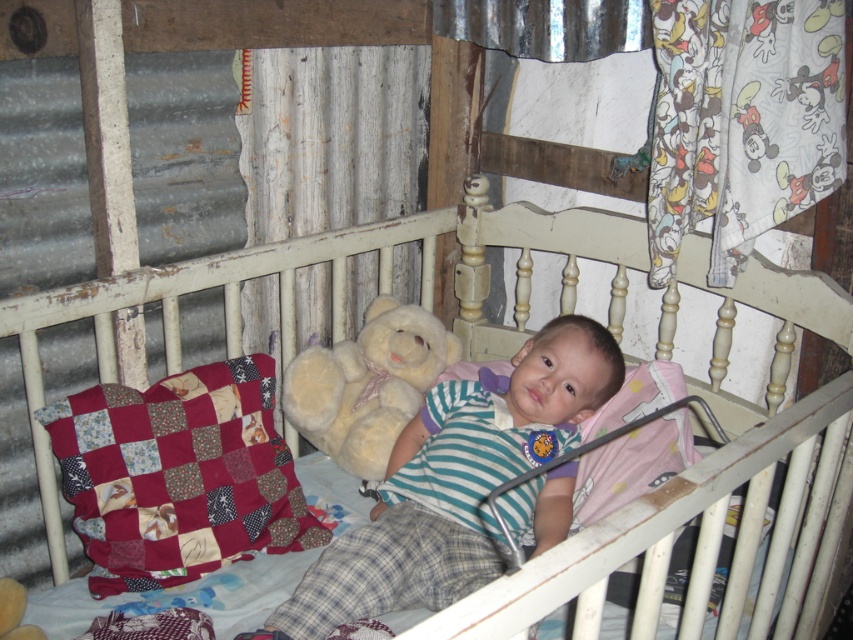
Who is more distant from viewer, [102,369] or [314,378]?

Positioned behind is point [314,378].

Is white wooden crib at center smaller than fluffy white teddy bear at center?

No, white wooden crib at center is not smaller than fluffy white teddy bear at center.

Is point (57, 534) more distant than point (408, 348)?

No, it is in front of (408, 348).

Identify the location of white wooden crib at center. The image size is (853, 640). (711, 480).

Does patchwork fabric pillow at left have a greater height compared to fluffy white teddy bear at center?

Correct, patchwork fabric pillow at left is much taller as fluffy white teddy bear at center.

The width and height of the screenshot is (853, 640). Describe the element at coordinates (178, 476) in the screenshot. I see `patchwork fabric pillow at left` at that location.

Is point (120, 532) farther from viewer compared to point (299, 392)?

No, it is in front of (299, 392).

This screenshot has width=853, height=640. Identify the location of patchwork fabric pillow at left. (178, 476).

Which is behind, point (402, 548) or point (260, 536)?

Positioned behind is point (260, 536).

Is point (497, 541) farther from viewer compared to point (219, 445)?

No.

Where is `soft beige teddy bear at center`? soft beige teddy bear at center is located at coordinates (454, 483).